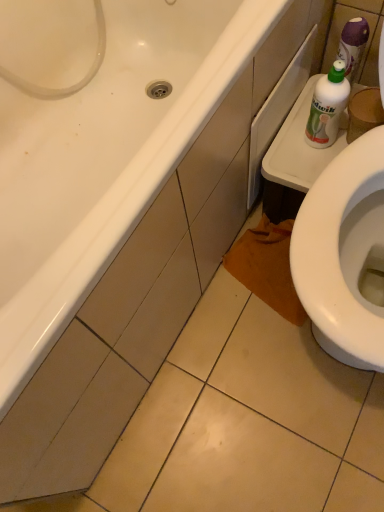
Question: Should I look upward or downward to see white glossy bathtub at upper left?

Choices:
 (A) up
 (B) down

Answer: (A)

Question: Is green plastic bottle at upper right at the back of white glossy bathtub at upper left?

Choices:
 (A) no
 (B) yes

Answer: (A)

Question: Is the depth of white glossy bathtub at upper left greater than that of green plastic bottle at upper right?

Choices:
 (A) yes
 (B) no

Answer: (B)

Question: Considering the relative sizes of white glossy bathtub at upper left and green plastic bottle at upper right in the image provided, is white glossy bathtub at upper left thinner than green plastic bottle at upper right?

Choices:
 (A) yes
 (B) no

Answer: (B)

Question: Is green plastic bottle at upper right inside white glossy bathtub at upper left?

Choices:
 (A) yes
 (B) no

Answer: (B)

Question: Is white glossy bathtub at upper left located outside green plastic bottle at upper right?

Choices:
 (A) no
 (B) yes

Answer: (B)

Question: Does white glossy bathtub at upper left appear on the right side of green plastic bottle at upper right?

Choices:
 (A) yes
 (B) no

Answer: (B)

Question: Does green plastic bottle at upper right have a greater height compared to white glossy bathtub at upper left?

Choices:
 (A) no
 (B) yes

Answer: (A)

Question: From a real-world perspective, is green plastic bottle at upper right located higher than white glossy bathtub at upper left?

Choices:
 (A) yes
 (B) no

Answer: (A)

Question: Considering the relative sizes of green plastic bottle at upper right and white glossy bathtub at upper left in the image provided, is green plastic bottle at upper right smaller than white glossy bathtub at upper left?

Choices:
 (A) yes
 (B) no

Answer: (A)

Question: Is green plastic bottle at upper right oriented towards white glossy bathtub at upper left?

Choices:
 (A) yes
 (B) no

Answer: (B)

Question: From a real-world perspective, is green plastic bottle at upper right under white glossy bathtub at upper left?

Choices:
 (A) yes
 (B) no

Answer: (B)

Question: Is green plastic bottle at upper right oriented away from white glossy bathtub at upper left?

Choices:
 (A) yes
 (B) no

Answer: (B)

Question: Is white glossy bathtub at upper left in front of or behind green plastic bottle at upper right in the image?

Choices:
 (A) behind
 (B) front

Answer: (B)